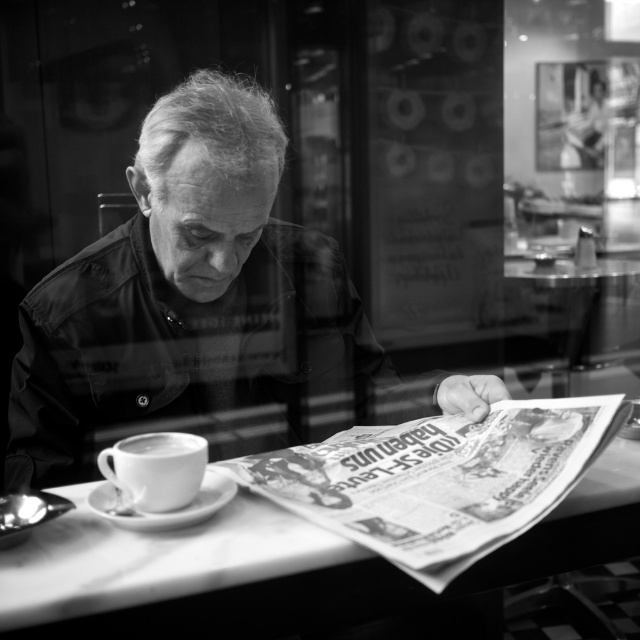
Does point (285, 582) come behind point (173, 444)?

That is False.

Between white marble table at center and white ceramic cup at lower left, which one is positioned higher?

white ceramic cup at lower left

Measure the distance between white marble table at center and camera.

21.30 inches

Identify the location of white marble table at center. (193, 577).

Between smooth leather jacket at center and white glossy cup at lower left, which one appears on the left side from the viewer's perspective?

white glossy cup at lower left is more to the left.

Is smooth leather jacket at center closer to camera compared to white glossy cup at lower left?

No, smooth leather jacket at center is behind white glossy cup at lower left.

Between point (134, 288) and point (150, 436), which one is positioned behind?

Point (134, 288)

Find the location of a particular element. smooth leather jacket at center is located at coordinates (204, 310).

Which is in front, point (538, 529) or point (140, 440)?

Point (538, 529) is more forward.

Is point (298, 541) farther from camera compared to point (147, 436)?

No, (298, 541) is in front of (147, 436).

Image resolution: width=640 pixels, height=640 pixels. What are the coordinates of `white marble table at center` in the screenshot? It's located at (193, 577).